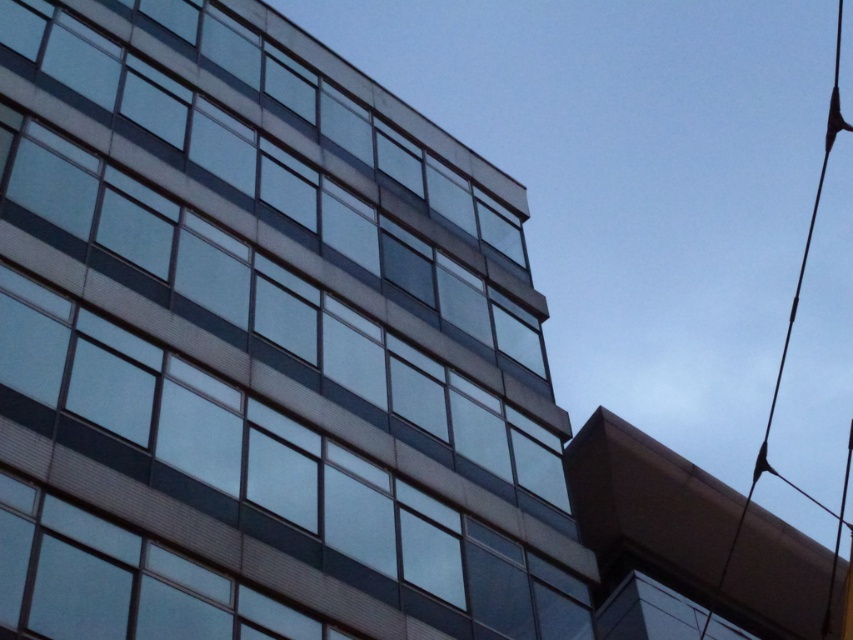
Question: Can you confirm if transparent glass windows at center is positioned to the right of black wire at upper right?

Choices:
 (A) no
 (B) yes

Answer: (A)

Question: Does transparent glass windows at center appear under black wire at upper right?

Choices:
 (A) no
 (B) yes

Answer: (B)

Question: Is transparent glass windows at center positioned before black wire at upper right?

Choices:
 (A) no
 (B) yes

Answer: (B)

Question: Which point is farther from the camera taking this photo?

Choices:
 (A) (236, 61)
 (B) (767, 419)

Answer: (B)

Question: Among these points, which one is nearest to the camera?

Choices:
 (A) (51, 342)
 (B) (843, 129)

Answer: (A)